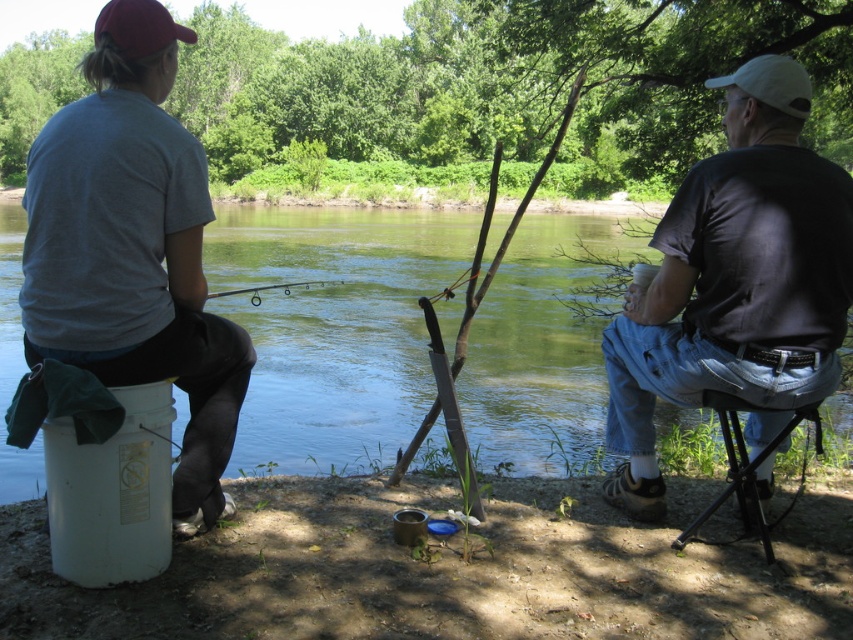
Consider the image. Between green water at center and black plastic stool at lower right, which one is positioned higher?

Positioned higher is green water at center.

The height and width of the screenshot is (640, 853). Describe the element at coordinates (334, 326) in the screenshot. I see `green water at center` at that location.

Where is `green water at center`? The height and width of the screenshot is (640, 853). green water at center is located at coordinates tap(334, 326).

Is green water at center closer to the viewer compared to dark gray t-shirt at right?

No, it is behind dark gray t-shirt at right.

What do you see at coordinates (334, 326) in the screenshot? The width and height of the screenshot is (853, 640). I see `green water at center` at bounding box center [334, 326].

Image resolution: width=853 pixels, height=640 pixels. In order to click on green water at center in this screenshot , I will do point(334,326).

Which is more to the right, green water at center or clear plastic rod at center?

Positioned to the right is clear plastic rod at center.

Does point (354, 339) come behind point (306, 284)?

No, it is in front of (306, 284).

Identify the location of green water at center. (334, 326).